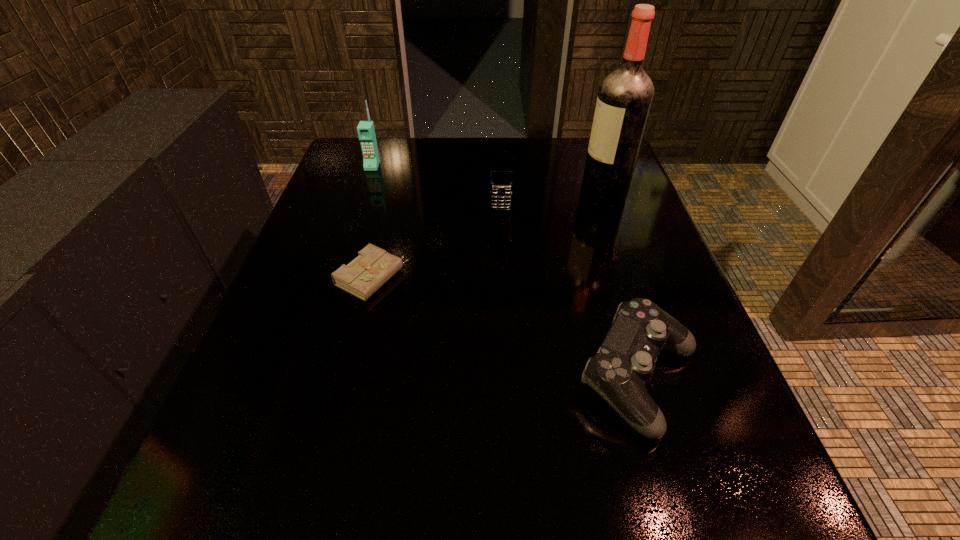
The width and height of the screenshot is (960, 540). In order to click on free spot that satisfies the following two spatial constraints: 1. on the keypad of the second tallest object; 2. on the left side of the second nearest object in this screenshot , I will do `click(334, 278)`.

You are a GUI agent. You are given a task and a screenshot of the screen. Output one action in this format:
    pyautogui.click(x=<x>, y=<y>)
    Task: Click on the vacant space that satisfies the following two spatial constraints: 1. on the screen of the nearer cellular telephone; 2. on the right side of the fourth tallest object
    The width and height of the screenshot is (960, 540).
    Given the screenshot: What is the action you would take?
    pyautogui.click(x=510, y=379)

Find the location of a particular element. The width and height of the screenshot is (960, 540). vacant region that satisfies the following two spatial constraints: 1. on the front-facing side of the liquor; 2. on the screen of the third object from left to right is located at coordinates (608, 210).

Identify the location of vacant area that satisfies the following two spatial constraints: 1. on the screen of the shorter cellular telephone; 2. on the left side of the second shortest object. This screenshot has width=960, height=540. 510,379.

Image resolution: width=960 pixels, height=540 pixels. In order to click on vacant space that satisfies the following two spatial constraints: 1. on the front-facing side of the liquor; 2. on the front side of the control in this screenshot , I will do `click(668, 379)`.

Identify the location of free location that satisfies the following two spatial constraints: 1. on the keypad of the farther cellular telephone; 2. on the left side of the shortest object. This screenshot has width=960, height=540. (334, 278).

Where is `free location that satisfies the following two spatial constraints: 1. on the keypad of the second shortest object; 2. on the right side of the left cellular telephone`? The width and height of the screenshot is (960, 540). free location that satisfies the following two spatial constraints: 1. on the keypad of the second shortest object; 2. on the right side of the left cellular telephone is located at coordinates (300, 379).

This screenshot has width=960, height=540. I want to click on free point that satisfies the following two spatial constraints: 1. on the keypad of the farthest object; 2. on the right side of the diary, so click(334, 278).